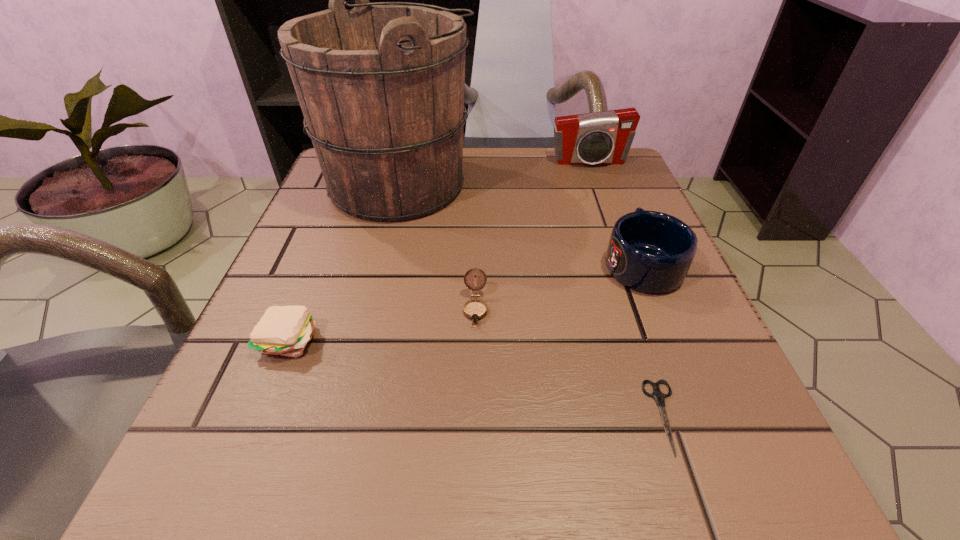
Where is `blank space located with the handle on the side of the fourth shortest object`? blank space located with the handle on the side of the fourth shortest object is located at coordinates (614, 197).

The image size is (960, 540). Identify the location of vacant space located 0.310m with the handle on the side of the fourth shortest object. (597, 155).

You are a GUI agent. You are given a task and a screenshot of the screen. Output one action in this format:
    pyautogui.click(x=<x>, y=<y>)
    Task: Click on the vacant region located 0.220m on the face of the compass
    The image size is (960, 540).
    Given the screenshot: What is the action you would take?
    pyautogui.click(x=473, y=483)

What are the coordinates of `free space located 0.170m on the right of the patty` in the screenshot? It's located at (438, 339).

At what (x,y) coordinates should I click in order to perform the action: click on free region located on the back of the shortest object. Please return your answer as a coordinate pair (x, y). The width and height of the screenshot is (960, 540). Looking at the image, I should click on (595, 208).

You are a GUI agent. You are given a task and a screenshot of the screen. Output one action in this format:
    pyautogui.click(x=<x>, y=<y>)
    Task: Click on the bucket located at the far edge
    Image resolution: width=960 pixels, height=540 pixels.
    Given the screenshot: What is the action you would take?
    pyautogui.click(x=381, y=86)

At what (x,y) coordinates should I click in order to perform the action: click on camera that is at the far edge. Please return your answer as a coordinate pair (x, y). The image size is (960, 540). Looking at the image, I should click on (601, 138).

Find the location of a particular element. The width and height of the screenshot is (960, 540). object present at the near edge is located at coordinates (659, 397).

What are the coordinates of `bucket that is at the left edge` in the screenshot? It's located at (381, 86).

The width and height of the screenshot is (960, 540). What are the coordinates of `patty that is positioned at the left edge` in the screenshot? It's located at (283, 330).